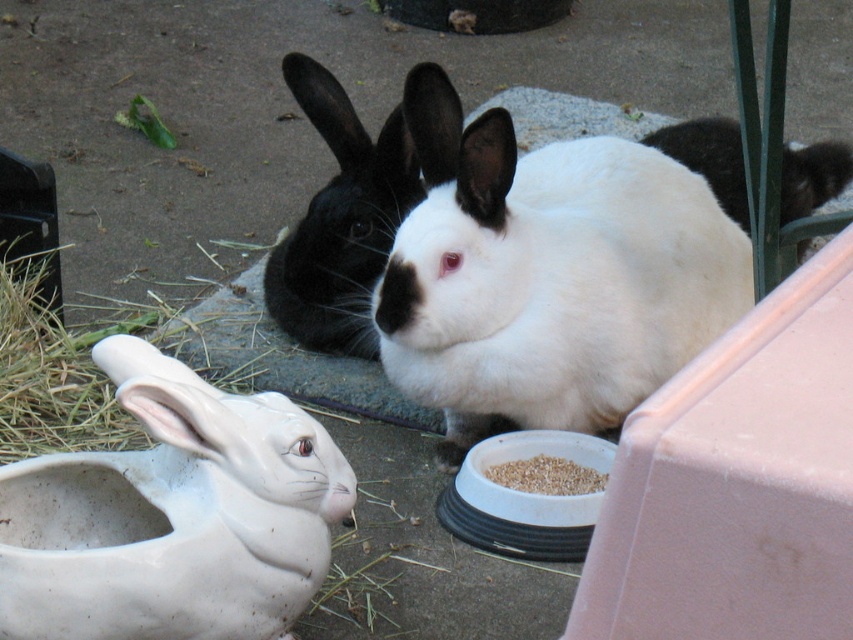
Which is more to the right, white matte ceramic rabbit at lower left or black matte rabbit at center?

Positioned to the right is black matte rabbit at center.

Who is positioned more to the left, white matte ceramic rabbit at lower left or black matte rabbit at center?

white matte ceramic rabbit at lower left

Locate an element on the screen. white matte ceramic rabbit at lower left is located at coordinates (x=172, y=515).

Measure the distance between point (461, 257) and camera.

Point (461, 257) and camera are 1.99 meters apart.

Which is in front, point (408, 218) or point (369, 150)?

Positioned in front is point (408, 218).

Is point (427, 376) less distant than point (276, 278)?

Yes, it is in front of point (276, 278).

Where is `white soft fur rabbit at center`? white soft fur rabbit at center is located at coordinates (549, 276).

Which of these two, white soft fur rabbit at center or brown grain at lower center, stands taller?

white soft fur rabbit at center

This screenshot has height=640, width=853. Identify the location of white soft fur rabbit at center. (549, 276).